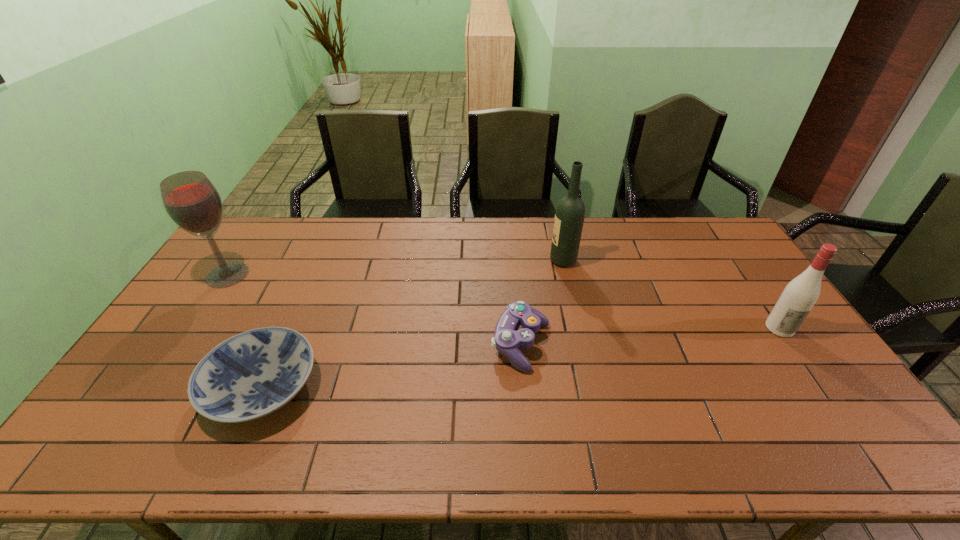
Where is `vacant space situated on the labeled side of the wine bottle`? This screenshot has width=960, height=540. vacant space situated on the labeled side of the wine bottle is located at coordinates (524, 261).

The width and height of the screenshot is (960, 540). I want to click on free space located 0.320m on the front of the leftmost object, so click(166, 368).

Find the location of a particular element. The image size is (960, 540). blank area located 0.080m on the label of the right alcohol is located at coordinates (802, 360).

You are a GUI agent. You are given a task and a screenshot of the screen. Output one action in this format:
    pyautogui.click(x=<x>, y=<y>)
    Task: Click on the vacant region located 0.320m on the right of the control
    The width and height of the screenshot is (960, 540).
    Given the screenshot: What is the action you would take?
    pyautogui.click(x=662, y=345)

Image resolution: width=960 pixels, height=540 pixels. Identify the location of free location located 0.060m on the front of the second object from left to right. (228, 463).

This screenshot has height=540, width=960. Find the location of `object located in the far edge section of the desktop`. object located in the far edge section of the desktop is located at coordinates (570, 212).

You are a GUI agent. You are given a task and a screenshot of the screen. Output one action in this format:
    pyautogui.click(x=<x>, y=<y>)
    Task: Click on the object present at the near edge
    This screenshot has width=960, height=540.
    Given the screenshot: What is the action you would take?
    pyautogui.click(x=253, y=374)

The width and height of the screenshot is (960, 540). I want to click on object that is at the left edge, so click(x=190, y=199).

In order to click on object that is positioned at the right edge in this screenshot , I will do `click(800, 295)`.

Identify the location of vacant space at the far edge of the desktop. (305, 251).